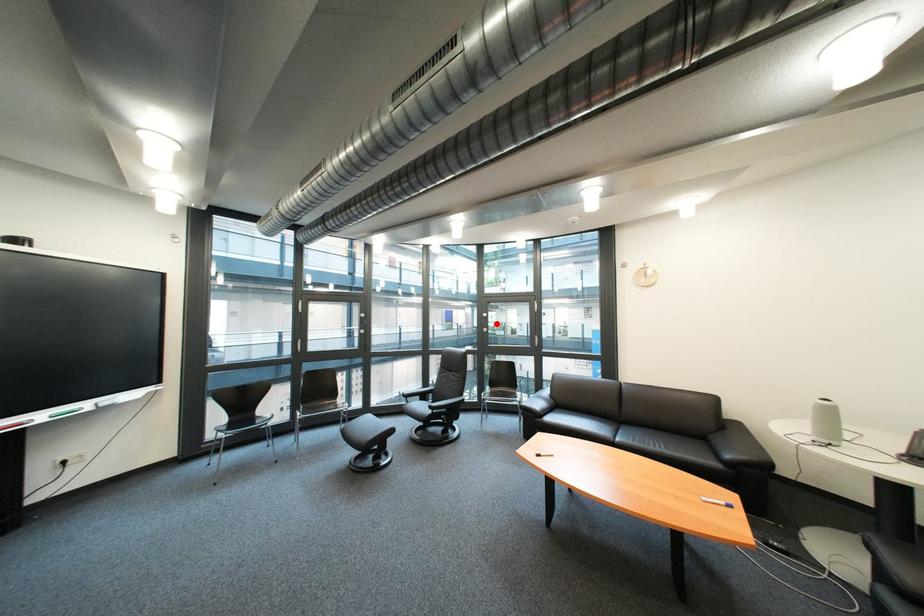
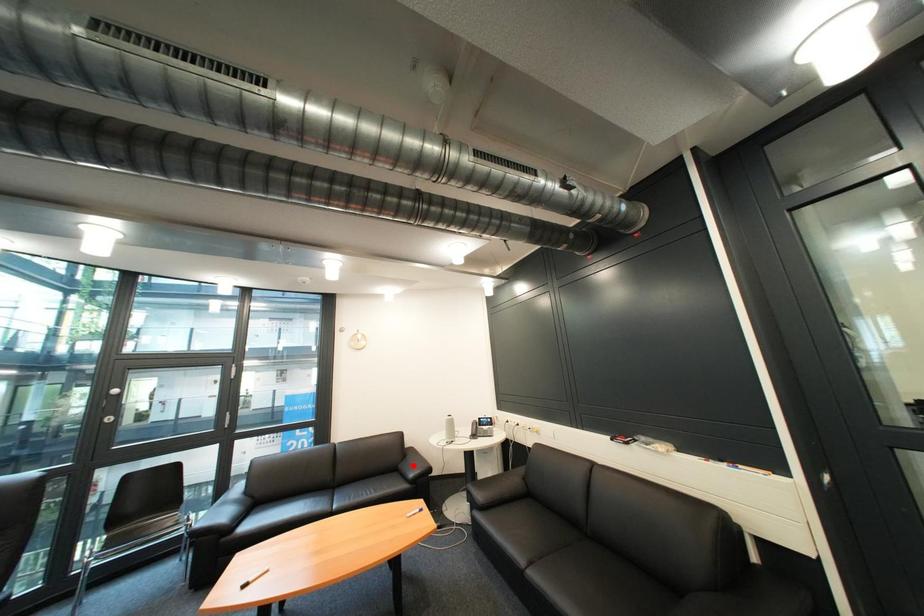
I am providing you with two images of the same scene from different viewpoints. A red point is marked on the first image and another point is marked on the second image. Does the point marked in image1 correspond to the same location as the one in image2?

No